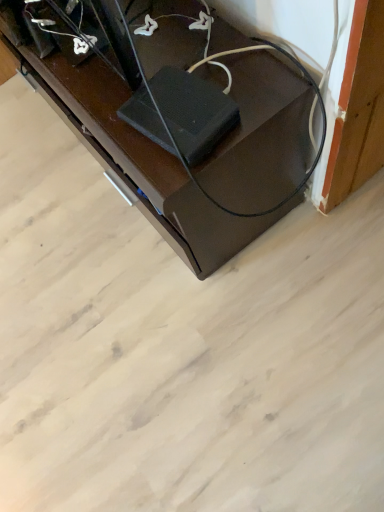
What do you see at coordinates (185, 127) in the screenshot? The width and height of the screenshot is (384, 512). I see `black glossy speaker at lower right` at bounding box center [185, 127].

You are a GUI agent. You are given a task and a screenshot of the screen. Output one action in this format:
    pyautogui.click(x=<x>, y=<y>)
    Task: Click on the black glossy speaker at lower right
    The width and height of the screenshot is (384, 512).
    Given the screenshot: What is the action you would take?
    coord(185,127)

Find the location of `black rubber speaker at center`. black rubber speaker at center is located at coordinates (193, 112).

Describe the element at coordinates (193, 112) in the screenshot. I see `black rubber speaker at center` at that location.

Where is `black glossy speaker at lower right`? This screenshot has width=384, height=512. black glossy speaker at lower right is located at coordinates (185, 127).

Would you say black glossy speaker at lower right is to the left or to the right of black rubber speaker at center in the picture?

From the image, it's evident that black glossy speaker at lower right is to the left of black rubber speaker at center.

From the picture: Which object is further away from the camera taking this photo, black glossy speaker at lower right or black rubber speaker at center?

black glossy speaker at lower right is further away from the camera.

Does point (17, 48) appear closer or farther from the camera than point (193, 114)?

Point (17, 48) is farther from the camera than point (193, 114).

From the image's perspective, which is above, black glossy speaker at lower right or black rubber speaker at center?

black glossy speaker at lower right appears higher in the image.

From a real-world perspective, is black glossy speaker at lower right on black rubber speaker at center?

No, from a real-world perspective, black glossy speaker at lower right is not on top of black rubber speaker at center.

Is black glossy speaker at lower right thinner than black rubber speaker at center?

No, black glossy speaker at lower right is not thinner than black rubber speaker at center.

Does black glossy speaker at lower right have a greater height compared to black rubber speaker at center?

Yes.

Which of these two, black glossy speaker at lower right or black rubber speaker at center, is smaller?

black rubber speaker at center.

Consider the image. Can we say black glossy speaker at lower right lies outside black rubber speaker at center?

Yes, black glossy speaker at lower right is not within black rubber speaker at center.

Looking at this image, is black glossy speaker at lower right not near black rubber speaker at center?

No.

Does black glossy speaker at lower right turn towards black rubber speaker at center?

No, black glossy speaker at lower right is not oriented towards black rubber speaker at center.

How distant is black glossy speaker at lower right from black rubber speaker at center?

black glossy speaker at lower right and black rubber speaker at center are 6.02 inches apart.

Where is `furniture above the black rubber speaker at center (from the image's perspective)`? The height and width of the screenshot is (512, 384). furniture above the black rubber speaker at center (from the image's perspective) is located at coordinates (185, 127).

Is black rubber speaker at center at the right side of black glossy speaker at lower right?

Yes.

Is black rubber speaker at center in front of black glossy speaker at lower right?

Yes, it is in front of black glossy speaker at lower right.

Considering the positions of points (233, 103) and (2, 15), is point (233, 103) farther from camera compared to point (2, 15)?

No, (233, 103) is closer to viewer.

From the image's perspective, does black rubber speaker at center appear lower than black glossy speaker at lower right?

Correct, black rubber speaker at center appears lower than black glossy speaker at lower right in the image.

From a real-world perspective, which object stands above the other?

black rubber speaker at center is physically above.

Considering the relative sizes of black rubber speaker at center and black glossy speaker at lower right in the image provided, is black rubber speaker at center thinner than black glossy speaker at lower right?

Correct, the width of black rubber speaker at center is less than that of black glossy speaker at lower right.

Who is shorter, black rubber speaker at center or black glossy speaker at lower right?

Standing shorter between the two is black rubber speaker at center.

In the scene shown: Is black rubber speaker at center smaller than black glossy speaker at lower right?

Correct, black rubber speaker at center occupies less space than black glossy speaker at lower right.

Does black rubber speaker at center contain black glossy speaker at lower right?

No.

Are black rubber speaker at center and black glossy speaker at lower right making contact?

No, black rubber speaker at center is not touching black glossy speaker at lower right.

Is black rubber speaker at center facing away from black glossy speaker at lower right?

No, black glossy speaker at lower right is not at the back of black rubber speaker at center.

How much distance is there between black rubber speaker at center and black glossy speaker at lower right?

6.02 inches.

Find the location of a particular element. furniture beneath the black rubber speaker at center (from a real-world perspective) is located at coordinates pyautogui.click(x=185, y=127).

Locate an element on the screen. This screenshot has width=384, height=512. furniture to the left of black rubber speaker at center is located at coordinates (185, 127).

Where is `wide on the right of black glossy speaker at lower right`? The height and width of the screenshot is (512, 384). wide on the right of black glossy speaker at lower right is located at coordinates (193, 112).